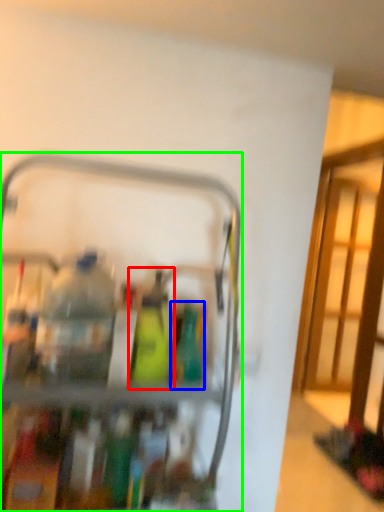
Question: Estimate the real-world distances between objects in this image. Which object is farther from bottle (highlighted by a red box), bottle (highlighted by a blue box) or appliance (highlighted by a green box)?

Choices:
 (A) bottle
 (B) appliance

Answer: (B)